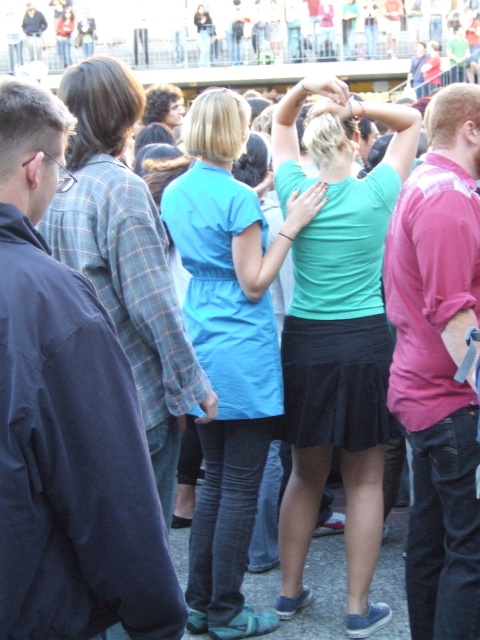
You are at a festival and want to take a photo of the pink cotton shirt at right. However, the matte green shirt at center is blocking your view. Can you move to the left to get a clear shot?

The pink cotton shirt at right is behind the matte green shirt at center, so moving to the left might help you see around the matte green shirt at center to capture the pink cotton shirt at right in your photo.

You are a photographer taking a picture of the crowd at the event. You notice two specific points in the frame, point A at coordinates point (311, 307) and point B at coordinates point (412, 198). Which point is closer to your camera?

Point A at coordinates point (311, 307) is closer to the camera than point B at coordinates point (412, 198) because it is further to the camera than the other point.

You are an event photographer trying to capture a photo of both the matte blue dress at center and the pink cotton shirt at right. Since you want to ensure both subjects are fully visible in the frame, which subject should you focus on first to account for their size difference?

The matte blue dress at center is taller than the pink cotton shirt at right, so you should focus on the matte blue dress at center first to ensure it fits properly in the frame before adjusting for the smaller pink cotton shirt at right.